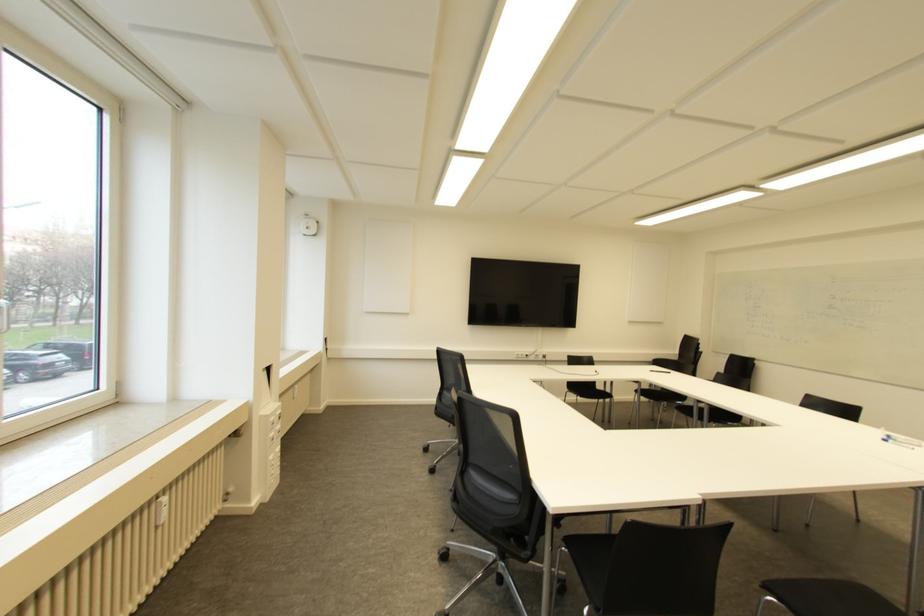
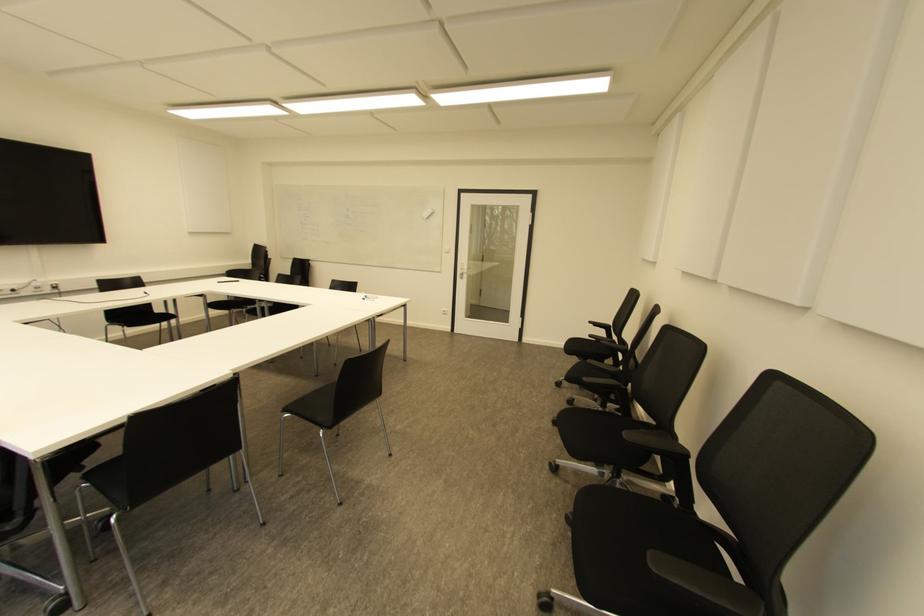
Question: How did the camera likely rotate?

Choices:
 (A) Left
 (B) Right
 (C) Up
 (D) Down

Answer: (B)